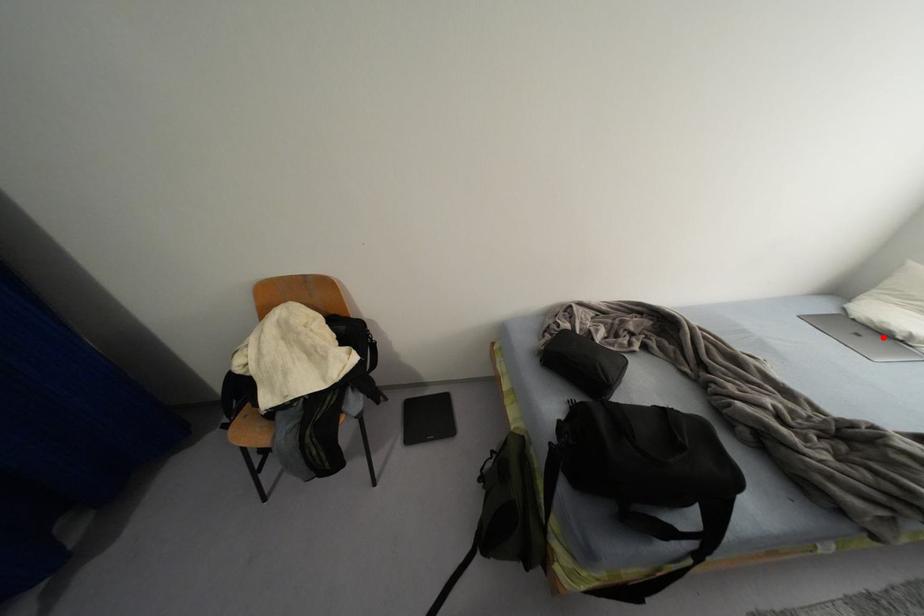
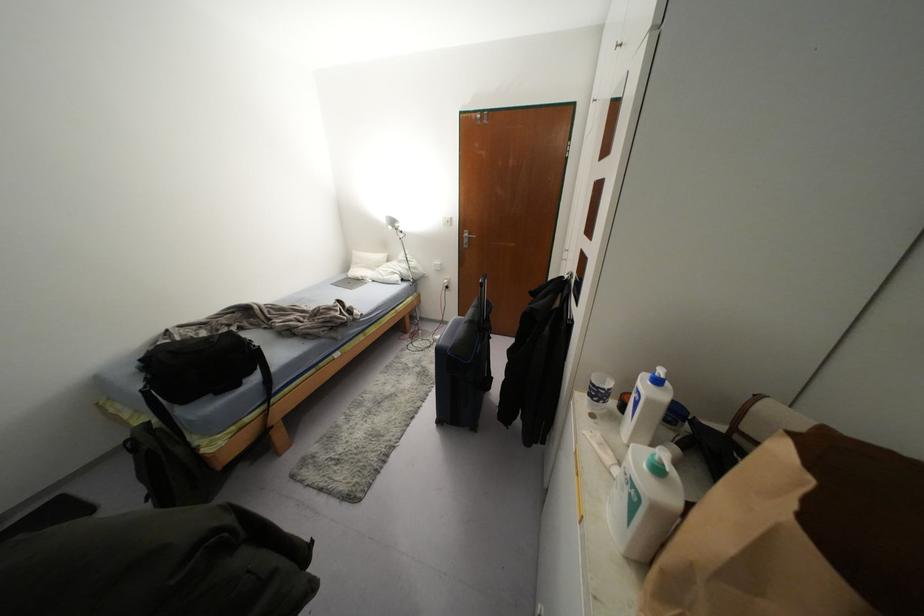
Question: I am providing you with two images of the same scene from different viewpoints. In image1, a red point is highlighted. Considering the same 3D point in image2, which of the following is correct?

Choices:
 (A) It is closer
 (B) It is farther

Answer: (A)